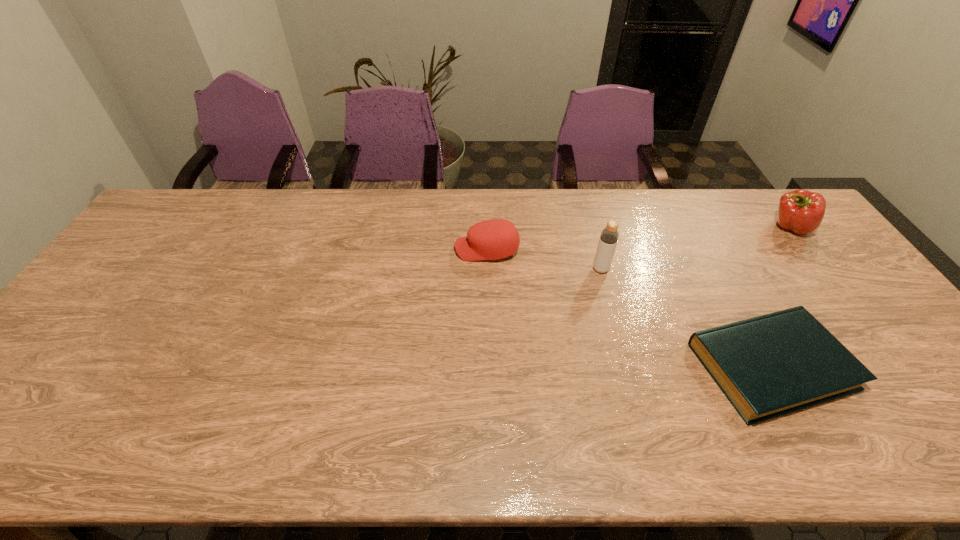
Where is `free space between the second object from left to right and the nearest object`? The image size is (960, 540). free space between the second object from left to right and the nearest object is located at coordinates (686, 318).

Locate an element on the screen. The width and height of the screenshot is (960, 540). free spot between the bottle and the leftmost object is located at coordinates (543, 259).

Where is `free space between the second tallest object and the cap`? Image resolution: width=960 pixels, height=540 pixels. free space between the second tallest object and the cap is located at coordinates (638, 238).

Find the location of a particular element. This screenshot has height=540, width=960. vacant area that lies between the shortest object and the third tallest object is located at coordinates (629, 308).

This screenshot has width=960, height=540. What are the coordinates of `object that is the third closest to the shortest object` in the screenshot? It's located at (494, 239).

Locate which object ranks third in proximity to the nearest object. Please provide its 2D coordinates. Your answer should be formatted as a tuple, i.e. [(x, y)], where the tuple contains the x and y coordinates of a point satisfying the conditions above.

[(494, 239)]

You are a GUI agent. You are given a task and a screenshot of the screen. Output one action in this format:
    pyautogui.click(x=<x>, y=<y>)
    Task: Click on the vacant space that satisfies the following two spatial constraints: 1. on the back side of the rightmost object; 2. on the left side of the second object from left to right
    
    Given the screenshot: What is the action you would take?
    pyautogui.click(x=589, y=227)

You are a GUI agent. You are given a task and a screenshot of the screen. Output one action in this format:
    pyautogui.click(x=<x>, y=<y>)
    Task: Click on the vacant space that satisfies the following two spatial constraints: 1. on the front-facing side of the book; 2. on the left side of the leftmost object
    Image resolution: width=960 pixels, height=540 pixels.
    Given the screenshot: What is the action you would take?
    pyautogui.click(x=489, y=366)

This screenshot has height=540, width=960. In order to click on free space that satisfies the following two spatial constraints: 1. on the front-facing side of the second object from left to right; 2. on the right side of the third tallest object in this screenshot , I will do `click(487, 269)`.

Locate an element on the screen. vacant point that satisfies the following two spatial constraints: 1. on the front-facing side of the book; 2. on the left side of the second shortest object is located at coordinates (489, 366).